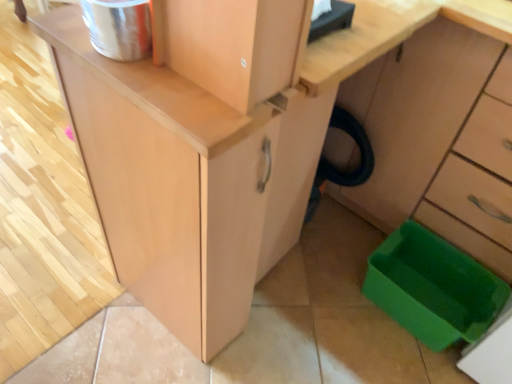
Question: Looking at the image, does green plastic storage box at lower right seem bigger or smaller compared to green plastic trash can at lower right?

Choices:
 (A) small
 (B) big

Answer: (A)

Question: Is green plastic storage box at lower right wider or thinner than green plastic trash can at lower right?

Choices:
 (A) wide
 (B) thin

Answer: (B)

Question: Which is correct: green plastic storage box at lower right is inside green plastic trash can at lower right, or outside of it?

Choices:
 (A) outside
 (B) inside

Answer: (A)

Question: Is green plastic trash can at lower right taller or shorter than green plastic storage box at lower right?

Choices:
 (A) tall
 (B) short

Answer: (A)

Question: Is green plastic trash can at lower right spatially inside green plastic storage box at lower right, or outside of it?

Choices:
 (A) inside
 (B) outside

Answer: (B)

Question: Considering the positions of green plastic trash can at lower right and green plastic storage box at lower right in the image, is green plastic trash can at lower right bigger or smaller than green plastic storage box at lower right?

Choices:
 (A) small
 (B) big

Answer: (B)

Question: Considering the positions of green plastic trash can at lower right and green plastic storage box at lower right in the image, is green plastic trash can at lower right wider or thinner than green plastic storage box at lower right?

Choices:
 (A) thin
 (B) wide

Answer: (B)